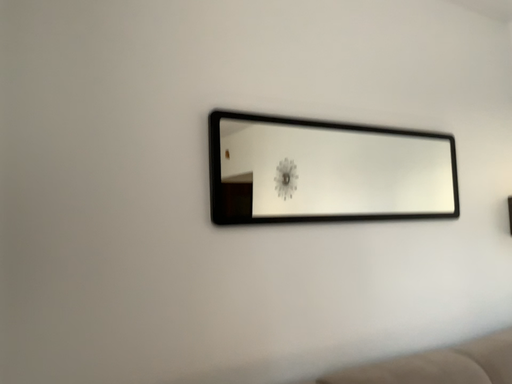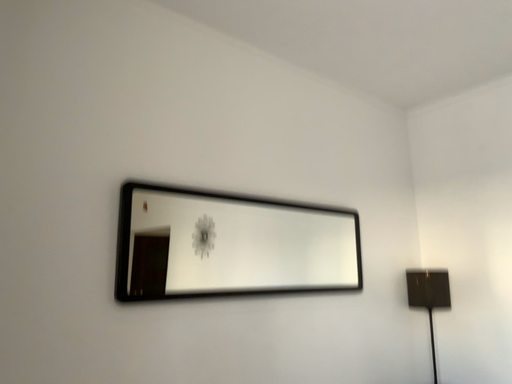
Question: Which way did the camera rotate in the video?

Choices:
 (A) rotated right
 (B) rotated left

Answer: (A)